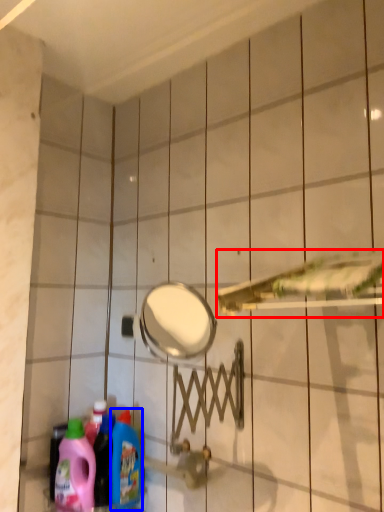
Question: Which of the following is the closest to the observer, shower (highlighted by a red box) or cleaning product (highlighted by a blue box)?

Choices:
 (A) shower
 (B) cleaning product

Answer: (A)